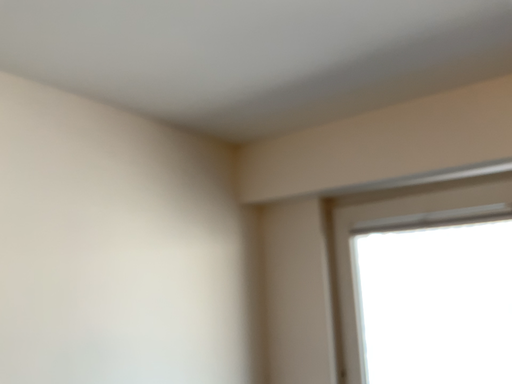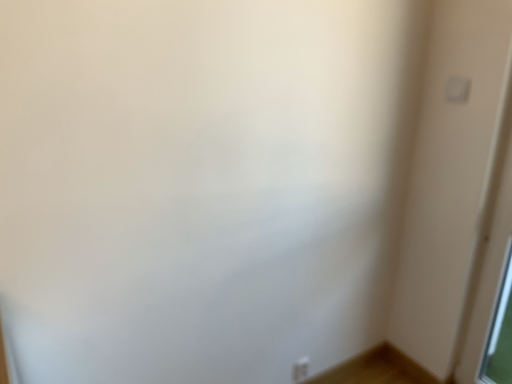
Question: Which way did the camera rotate in the video?

Choices:
 (A) rotated left
 (B) rotated right

Answer: (A)